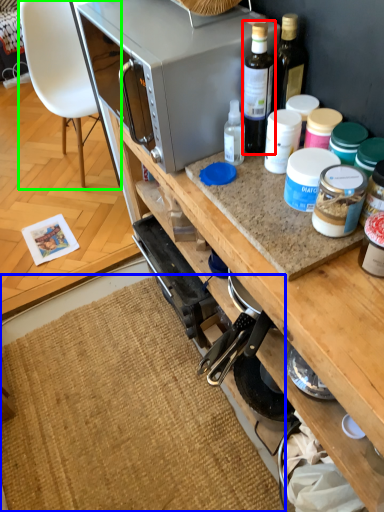
Question: Estimate the real-world distances between objects in this image. Which object is farther from bottle (highlighted by a red box), mat (highlighted by a blue box) or chair (highlighted by a green box)?

Choices:
 (A) mat
 (B) chair

Answer: (B)